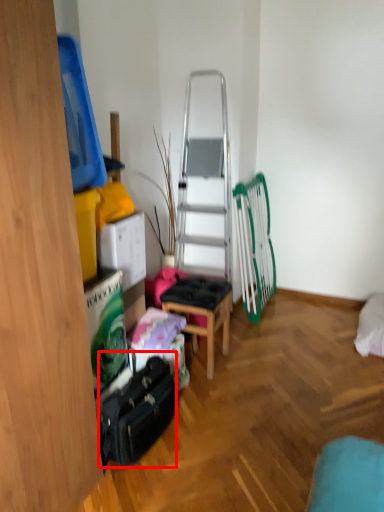
Question: In this image, where is luggage (annotated by the red box) located relative to stool?

Choices:
 (A) right
 (B) left

Answer: (B)